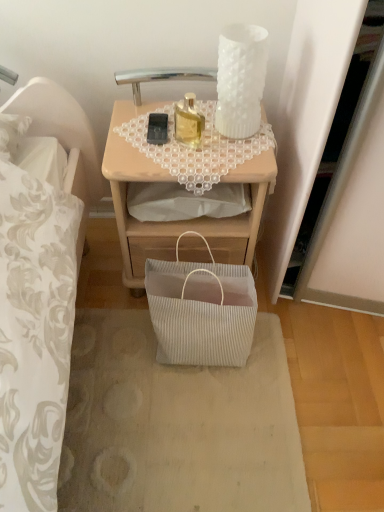
This screenshot has width=384, height=512. Identify the location of free space above wooden desk at center (from a real-world perspective). (186, 134).